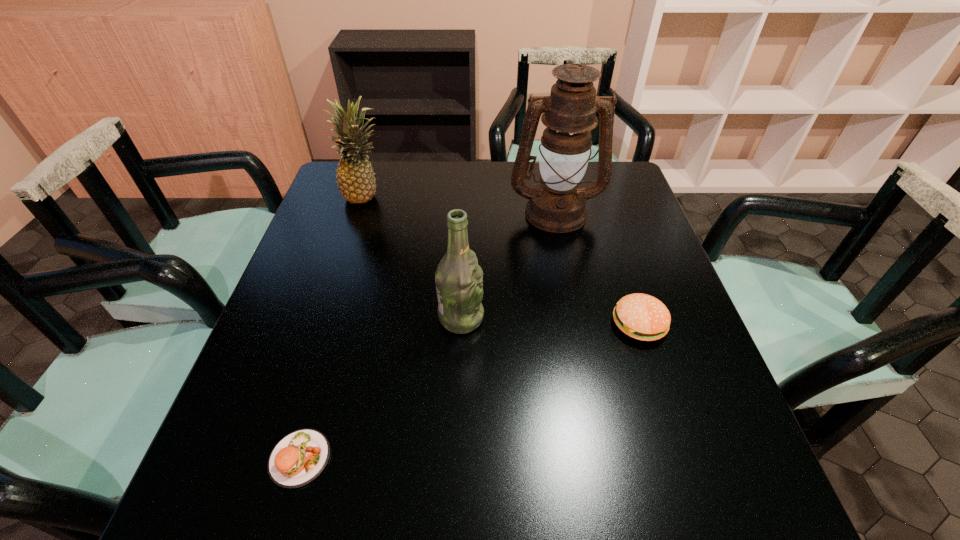
This screenshot has width=960, height=540. I want to click on blank space that satisfies the following two spatial constraints: 1. on the surface of the third object from left to right; 2. on the back side of the taller patty, so click(x=461, y=325).

Identify the location of vacant region that satisfies the following two spatial constraints: 1. on the surface of the right patty; 2. on the left side of the beer bottle. The image size is (960, 540). (461, 325).

I want to click on free space in the image that satisfies the following two spatial constraints: 1. on the front side of the tallest object; 2. on the left side of the farther patty, so click(578, 325).